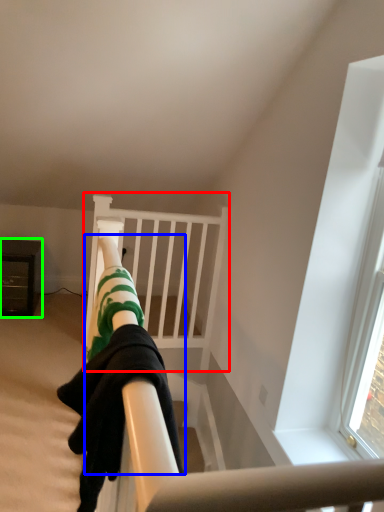
Question: Estimate the real-world distances between objects in this image. Which object is closer to bunk bed (highlighted by a red box), person (highlighted by a blue box) or furniture (highlighted by a green box)?

Choices:
 (A) person
 (B) furniture

Answer: (B)